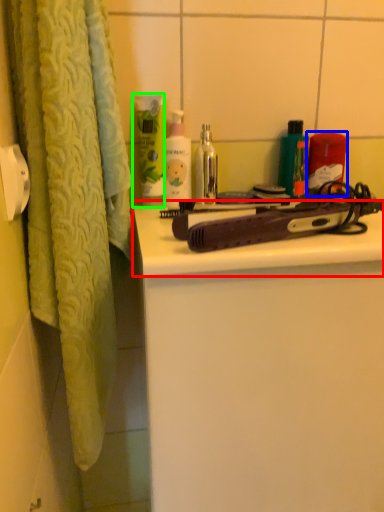
Question: Which object is positioned farthest from counter top (highlighted by a red box)? Select from product (highlighted by a blue box) and cleaning product (highlighted by a green box).

Choices:
 (A) product
 (B) cleaning product

Answer: (A)